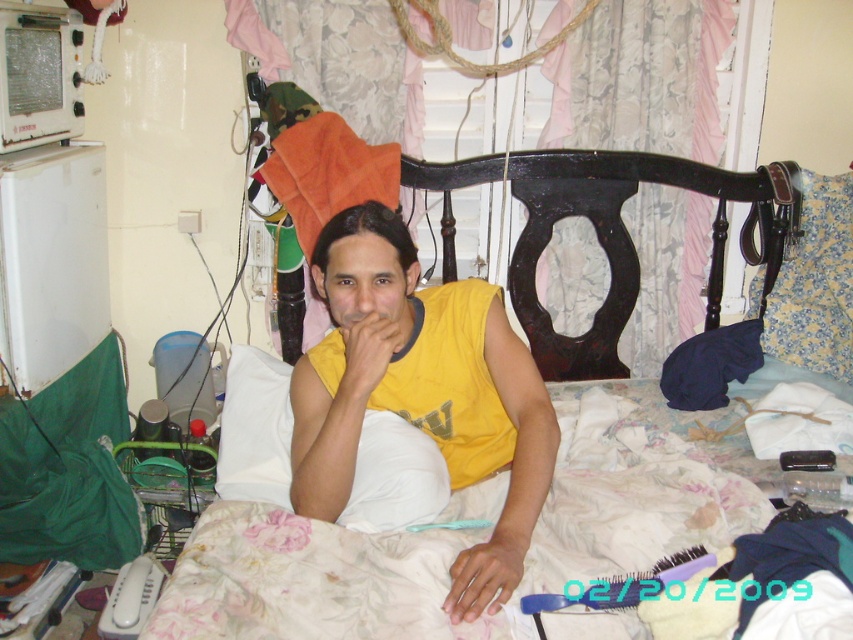
You are a furniture designer trying to place a new decorative item on the bed. You have a hand model of the smooth skin hand at lower center. Can you determine if the dark brown wood headboard at center can fit the hand model on its surface?

The dark brown wood headboard at center is wider than the smooth skin hand at lower center, so the hand model can fit on its surface.

You are standing at the point marked by coordinates point (308, 580) in the bedroom scene. What is directly beneath you?

The point (308, 580) is on the floral fabric bed at center, so the floral fabric bed at center is directly beneath you.

You are standing in the bedroom and want to reach the yellow matte hand at center without moving the floral fabric bed at center. Is this possible?

The floral fabric bed at center is closer to the viewer than the yellow matte hand at center, so you can reach the yellow matte hand at center without moving the bed because it is further away.